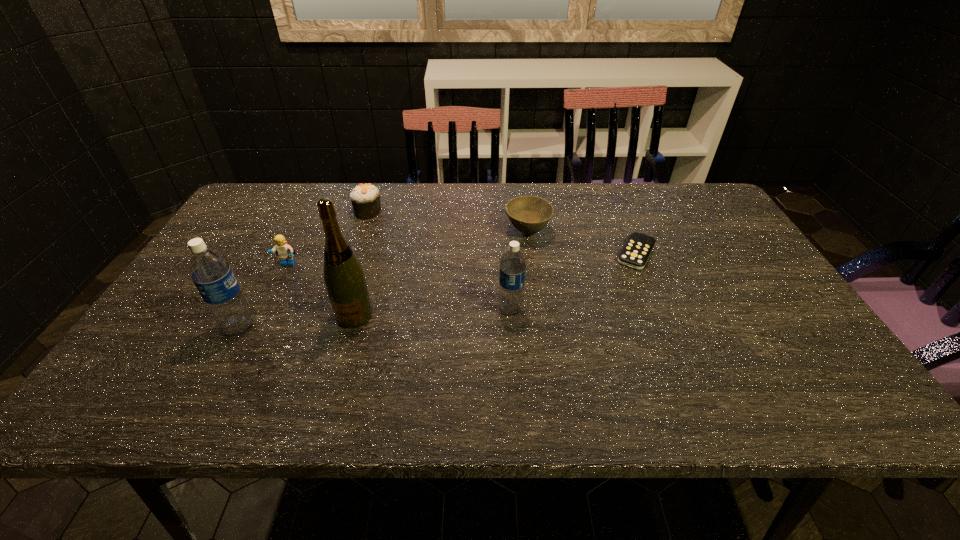
At what (x,y) coordinates should I click in order to perform the action: click on empty space between the taller water bottle and the Lego. Please return your answer as a coordinate pair (x, y). This screenshot has width=960, height=540. Looking at the image, I should click on (264, 295).

Identify the location of unoccupied position between the shorter water bottle and the Lego. The height and width of the screenshot is (540, 960). (399, 287).

The width and height of the screenshot is (960, 540). Identify the location of empty space between the left water bottle and the shortest object. [x=438, y=290].

Where is `blank region between the remote control and the Lego`? This screenshot has width=960, height=540. blank region between the remote control and the Lego is located at coordinates (462, 259).

The width and height of the screenshot is (960, 540). Identify the location of free area in between the Lego and the fifth shortest object. (399, 287).

Find the location of a particular element. The width and height of the screenshot is (960, 540). object that is the sixth closest to the Lego is located at coordinates (635, 253).

Point out which object is positioned as the third nearest to the fifth shortest object. Please provide its 2D coordinates. Your answer should be formatted as a tuple, i.e. [(x, y)], where the tuple contains the x and y coordinates of a point satisfying the conditions above.

[(344, 278)]

What are the coordinates of `vacant space that satisfies the following two spatial constraints: 1. on the front-facing side of the shorter water bottle; 2. on the right side of the Lego` in the screenshot? It's located at (265, 309).